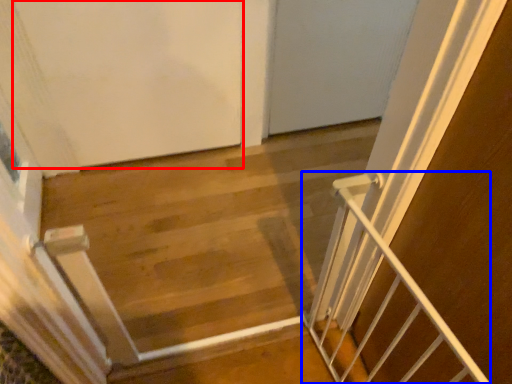
Question: Which point is further to the camera, door (highlighted by a red box) or stairs (highlighted by a blue box)?

Choices:
 (A) door
 (B) stairs

Answer: (A)